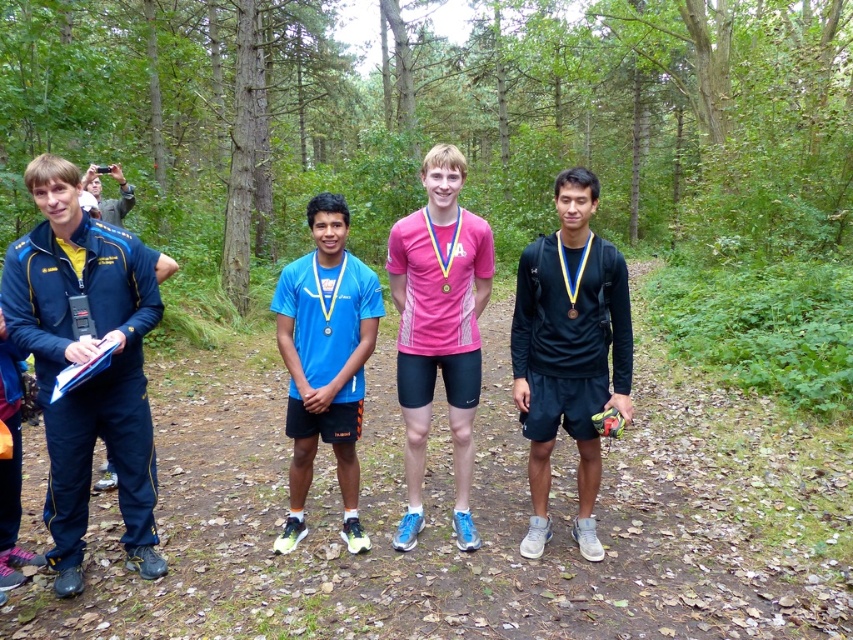
Does blue matte shorts at center have a smaller size compared to matte black jacket at left?

Incorrect, blue matte shorts at center is not smaller in size than matte black jacket at left.

Can you confirm if blue matte shorts at center is positioned to the left of matte black jacket at left?

Incorrect, blue matte shorts at center is not on the left side of matte black jacket at left.

Who is more distant from viewer, (363, 384) or (86, 170)?

The point (86, 170) is behind.

Find the location of a particular element. This screenshot has height=640, width=853. blue matte shorts at center is located at coordinates (325, 362).

Who is more distant from viewer, (515, 292) or (345, 541)?

Positioned behind is point (515, 292).

Find the location of `black matte shirt at center`. black matte shirt at center is located at coordinates (569, 352).

Between brown dirt trail at center and matte black jacket at left, which one appears on the right side from the viewer's perspective?

brown dirt trail at center is more to the right.

Is point (706, 436) positioned in front of point (126, 184)?

That is False.

Identify the location of brown dirt trail at center. (473, 515).